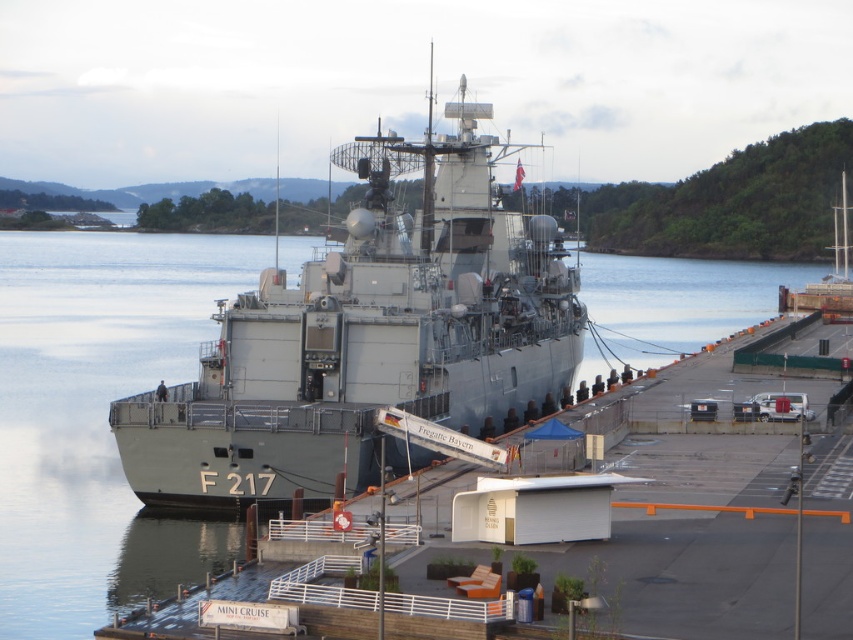
Question: Does gray metallic ship at center come behind gray metallic water at center?

Choices:
 (A) yes
 (B) no

Answer: (A)

Question: Observing the image, what is the correct spatial positioning of gray metallic ship at center in reference to gray metallic water at center?

Choices:
 (A) below
 (B) above

Answer: (B)

Question: Which point appears closest to the camera in this image?

Choices:
 (A) (128, 282)
 (B) (183, 449)

Answer: (B)

Question: Among these objects, which one is farthest from the camera?

Choices:
 (A) gray metallic ship at center
 (B) gray metallic water at center

Answer: (A)

Question: Where is gray metallic ship at center located in relation to gray metallic water at center in the image?

Choices:
 (A) above
 (B) below

Answer: (A)